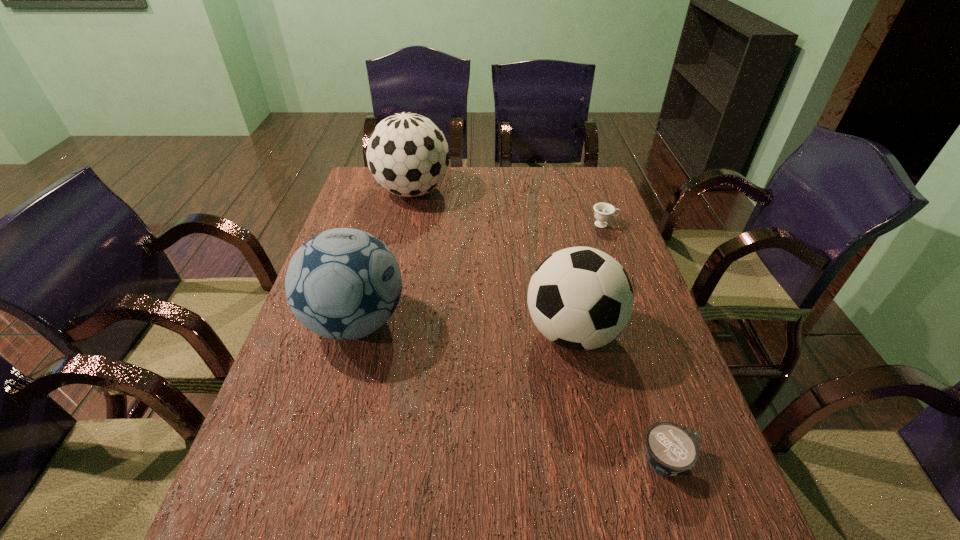
In order to click on the farthest object in this screenshot , I will do `click(408, 155)`.

The width and height of the screenshot is (960, 540). I want to click on the rightmost soccer ball, so click(x=580, y=298).

The width and height of the screenshot is (960, 540). I want to click on the fourth nearest object, so click(603, 212).

In order to click on yogurt in this screenshot , I will do `click(671, 448)`.

Where is `vacant area situated 0.330m on the right of the farthest object`? This screenshot has width=960, height=540. vacant area situated 0.330m on the right of the farthest object is located at coordinates (543, 192).

In order to click on blank space located on the front of the rightmost soccer ball in this screenshot , I will do 609,512.

The image size is (960, 540). Find the location of `free space located 0.110m on the left of the yogurt`. free space located 0.110m on the left of the yogurt is located at coordinates (582, 459).

Locate an element on the screen. This screenshot has height=540, width=960. object at the far edge is located at coordinates (408, 155).

The image size is (960, 540). I want to click on soccer ball present at the right edge, so click(x=580, y=298).

Locate an element on the screen. The height and width of the screenshot is (540, 960). teacup located in the right edge section of the desktop is located at coordinates (603, 212).